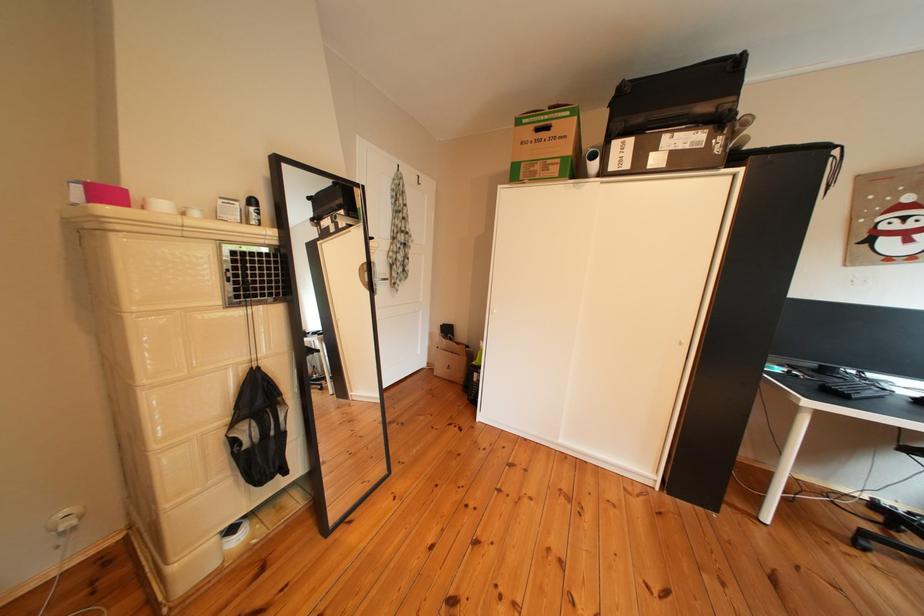
Find where to lift the black case handle. Please return your answer as a coordinate pair (x, y).

(610, 111)